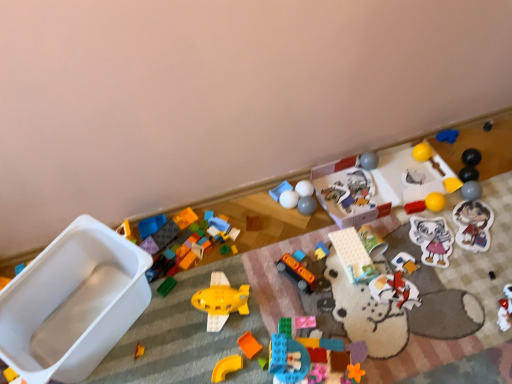
Find the location of a particular element. Image resolution: width=512 pixels, height=384 pixels. free area in between orange plastic block at lower left, acting as the 23th toy starting from the right, and matte plastic stickers at lower right, the 23th toy viewed from the left is located at coordinates (345, 279).